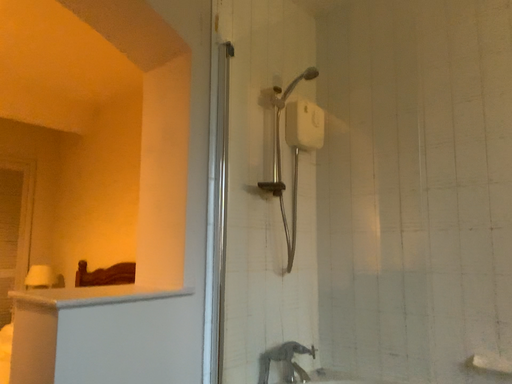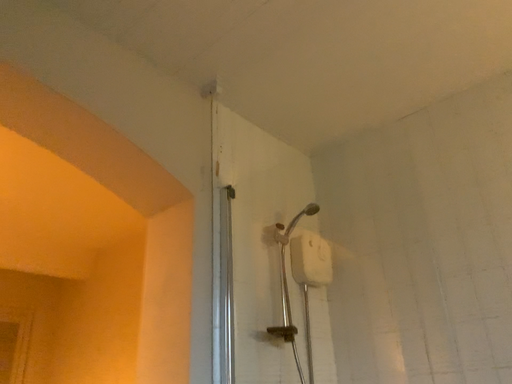
Question: How did the camera likely rotate when shooting the video?

Choices:
 (A) rotated upward
 (B) rotated downward

Answer: (A)